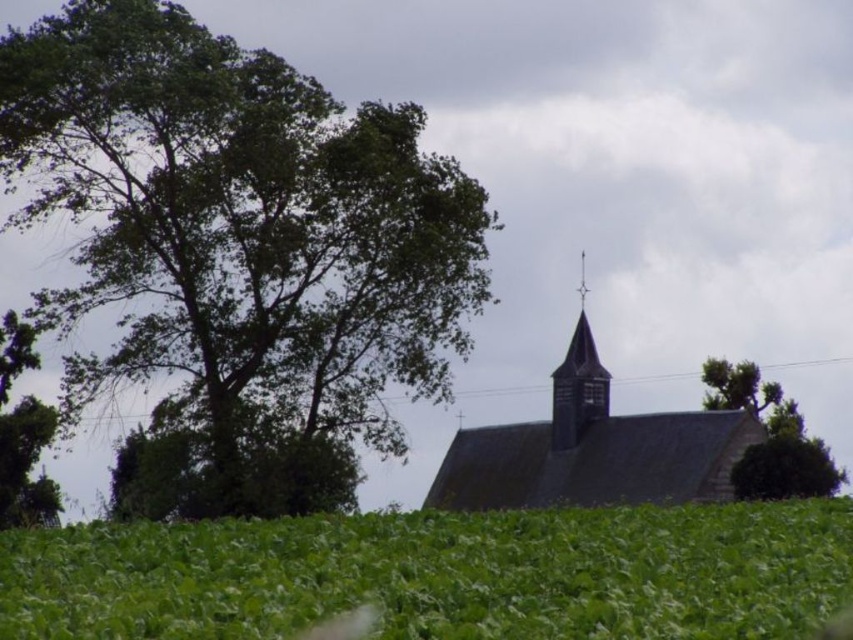
Does green leafy field at lower center appear on the right side of green leafy tree at upper right?

Incorrect, green leafy field at lower center is not on the right side of green leafy tree at upper right.

Who is higher up, green leafy field at lower center or green leafy tree at upper right?

green leafy tree at upper right is above.

Where is `green leafy field at lower center`? Image resolution: width=853 pixels, height=640 pixels. green leafy field at lower center is located at coordinates (440, 573).

Who is lower down, green leafy field at lower center or green leafy tree at left?

green leafy field at lower center

Is point (100, 573) closer to viewer compared to point (3, 513)?

Yes, it is in front of point (3, 513).

Which is in front, point (279, 588) or point (13, 488)?

Point (279, 588) is more forward.

You are a GUI agent. You are given a task and a screenshot of the screen. Output one action in this format:
    pyautogui.click(x=<x>, y=<y>)
    Task: Click on the green leafy field at lower center
    This screenshot has height=640, width=853.
    Given the screenshot: What is the action you would take?
    pyautogui.click(x=440, y=573)

Which is in front, point (805, 492) or point (752, 380)?

Point (805, 492)

Between green leafy bush at upper right and green leafy tree at upper right, which one has more height?

green leafy tree at upper right is taller.

Does point (769, 492) come in front of point (756, 416)?

Yes, point (769, 492) is in front of point (756, 416).

Find the location of `green leafy bush at upper right`. green leafy bush at upper right is located at coordinates (785, 468).